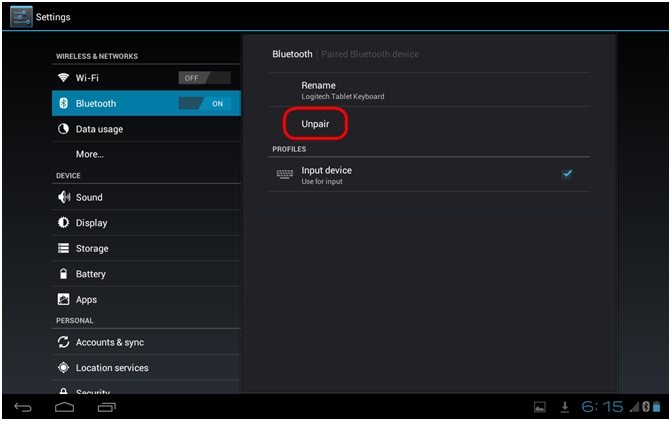
Find the location of a particular element. Image resolution: width=671 pixels, height=421 pixels. off toggle switch is located at coordinates (200, 75).